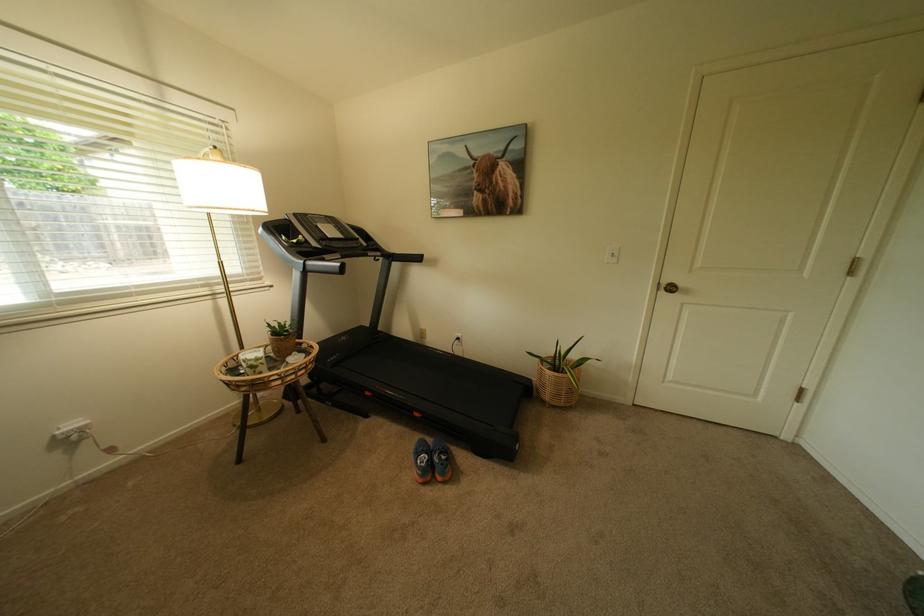
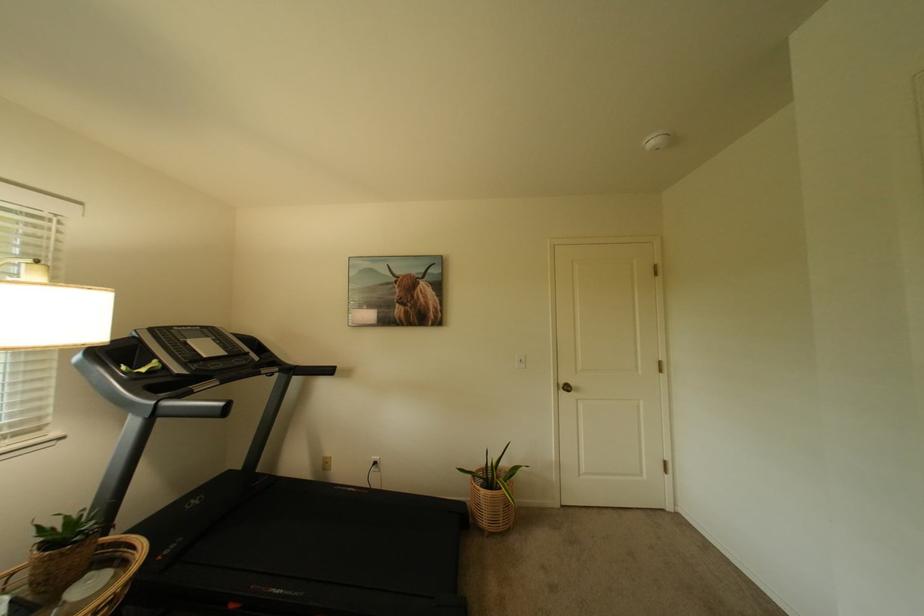
How did the camera likely rotate?

The rotation direction of the camera is right-up.